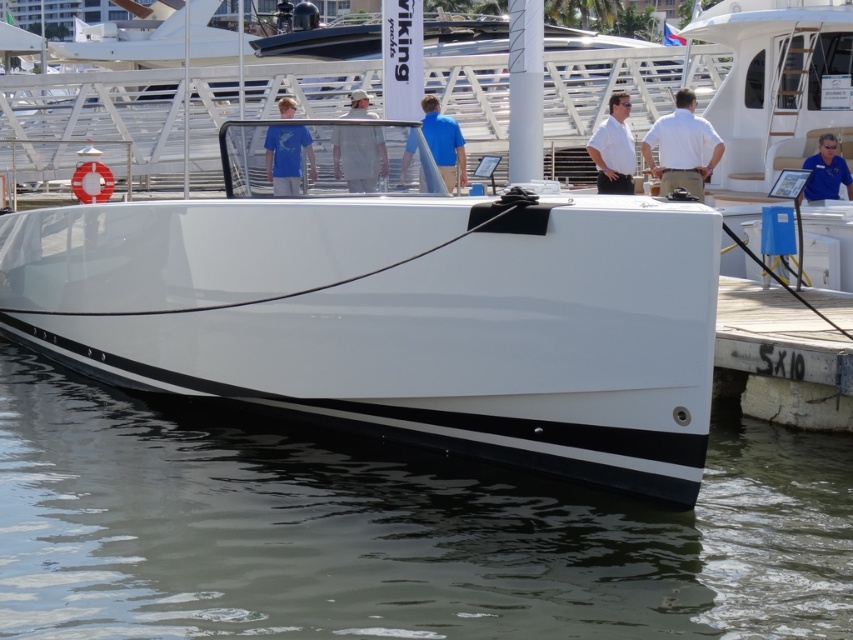
You are standing on the dock looking at the boat. There are two points marked on the boat. Which point is closer to you, point [697,150] or point [364,144]?

Point [697,150] is further to the viewer than point [364,144], so point [364,144] is closer to you.

You are a photographer taking a photo of the white cotton shirt at center and the matte blue shirt at center. Which shirt should you focus on first if you want to capture both in the same frame without moving the camera?

The white cotton shirt at center is positioned on the left side of matte blue shirt at center, so you should focus on the white cotton shirt at center first to ensure both shirts are in the frame without moving the camera.

You are a photographer taking a picture of the white cotton shirt at center and the matte blue shirt at center. Which shirt will appear taller in the photo?

The white cotton shirt at center will appear taller in the photo since it has a greater height compared to the matte blue shirt at center.